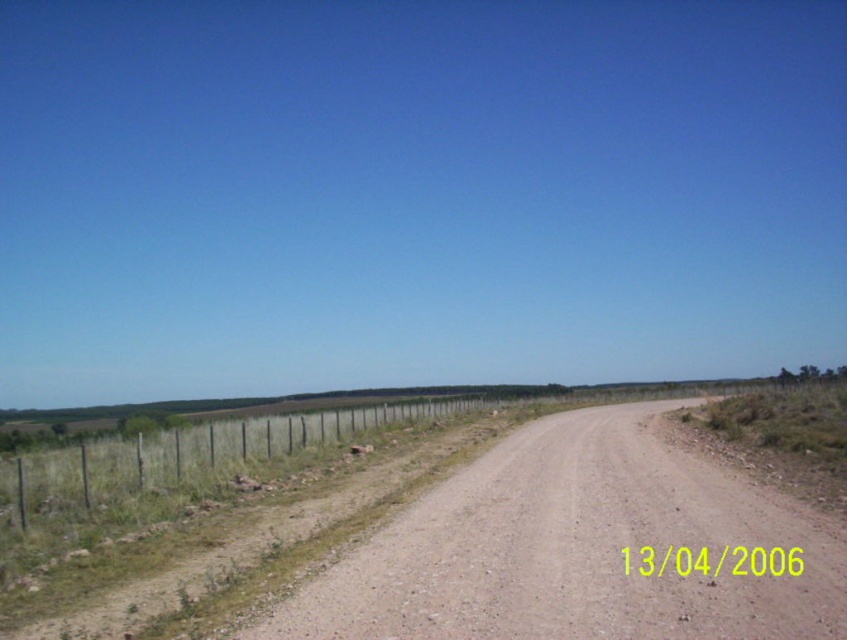
Is point (523, 545) behind point (189, 460)?

No, (523, 545) is closer to viewer.

Does brown gravel dirt track at center lie in front of metal wire fence at left?

Yes.

You are a GUI agent. You are given a task and a screenshot of the screen. Output one action in this format:
    pyautogui.click(x=<x>, y=<y>)
    Task: Click on the brown gravel dirt track at center
    This screenshot has height=640, width=847.
    Given the screenshot: What is the action you would take?
    pyautogui.click(x=579, y=547)